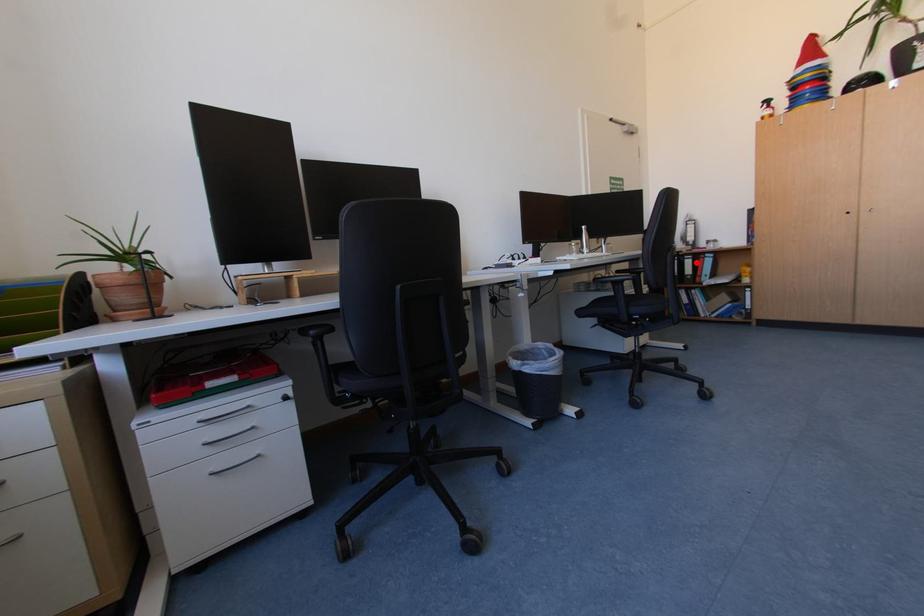
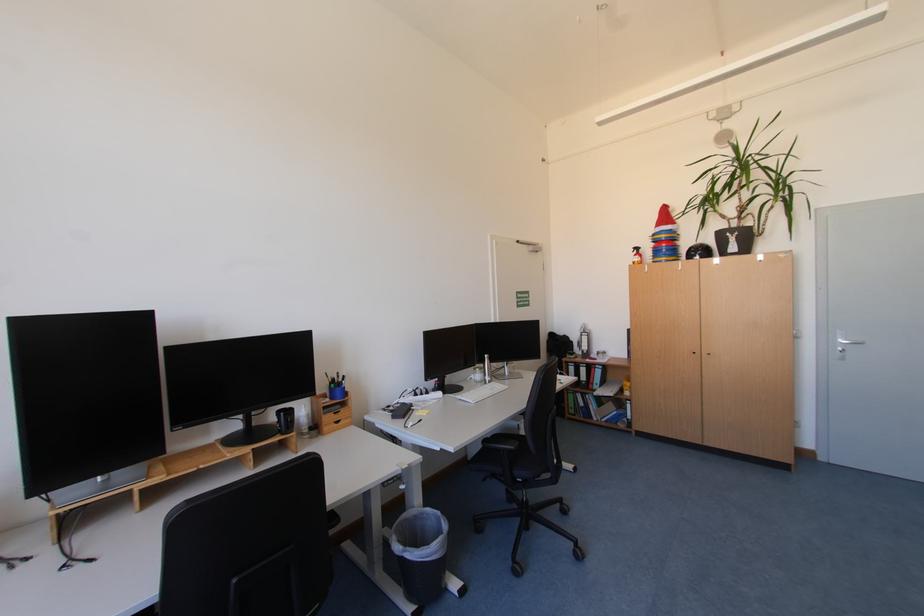
Question: I am providing you with two images of the same scene from different viewpoints. Image1 has a red point marked. In image2, the corresponding 3D location appears at what relative position? Reply with the corresponding letter.

Choices:
 (A) Closer
 (B) Farther

Answer: (B)